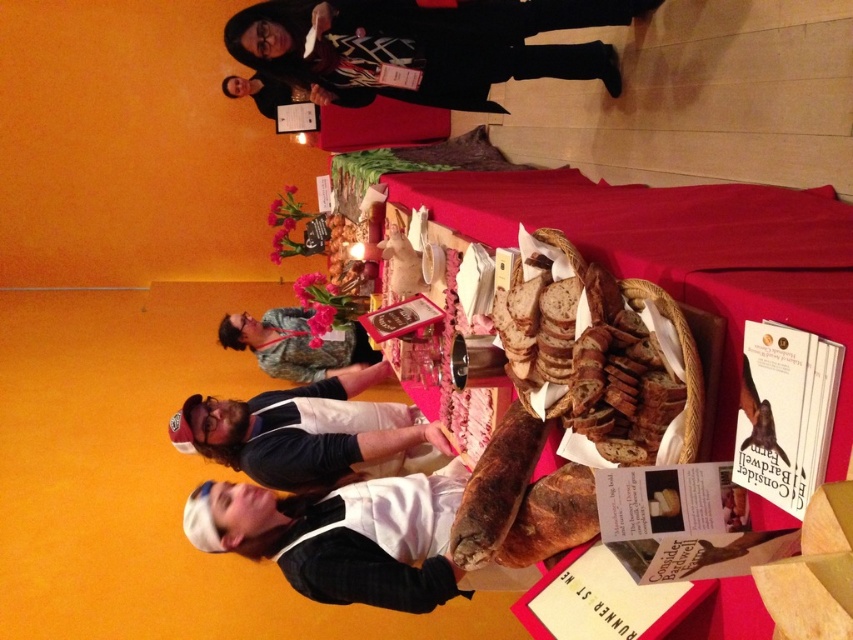
You are a guest at the event and need to reach the brown matte bread at center to take a slice. However, there is a black wool coat at upper center in the way. Can you easily access the bread without moving the coat?

The black wool coat at upper center is much taller than the brown matte bread at center, so it might block your view or access. You might need to move the coat or ask someone to help you reach the bread.

You are standing at the entrance of the event and want to approach the two people working at the table. Which of the two points, point (x=320, y=12) or point (x=364, y=369), is closer to you as you enter?

Point (x=320, y=12) is in front of point (x=364, y=369), so it is closer to you as you enter.

You are a guest at the event and want to take a closer look at the brown matte bread at center. However, the black wool coat at upper center is blocking your view. Can you see the bread clearly from where you are standing?

The brown matte bread at center is behind the black wool coat at upper center, so it is partially or fully obscured from your view. You cannot see the bread clearly.